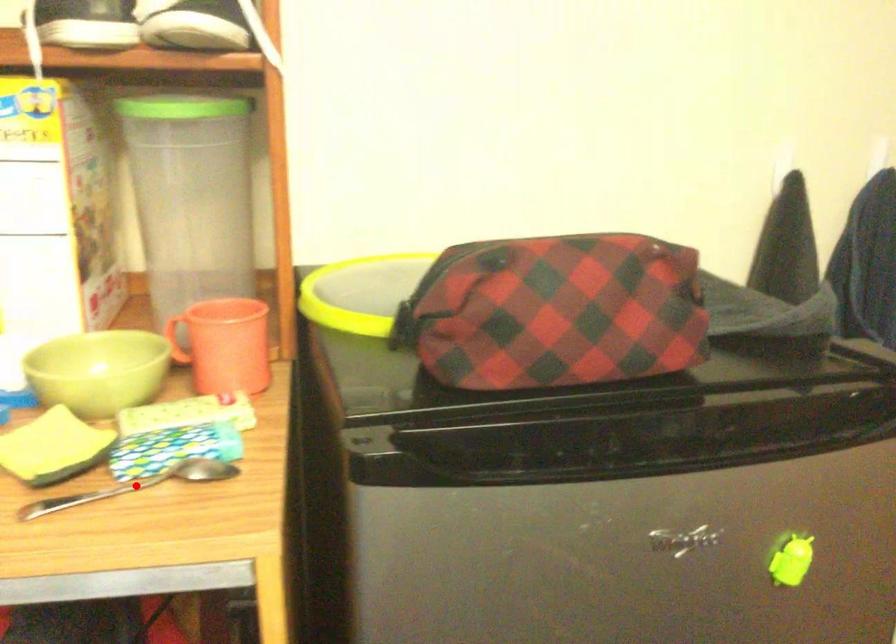
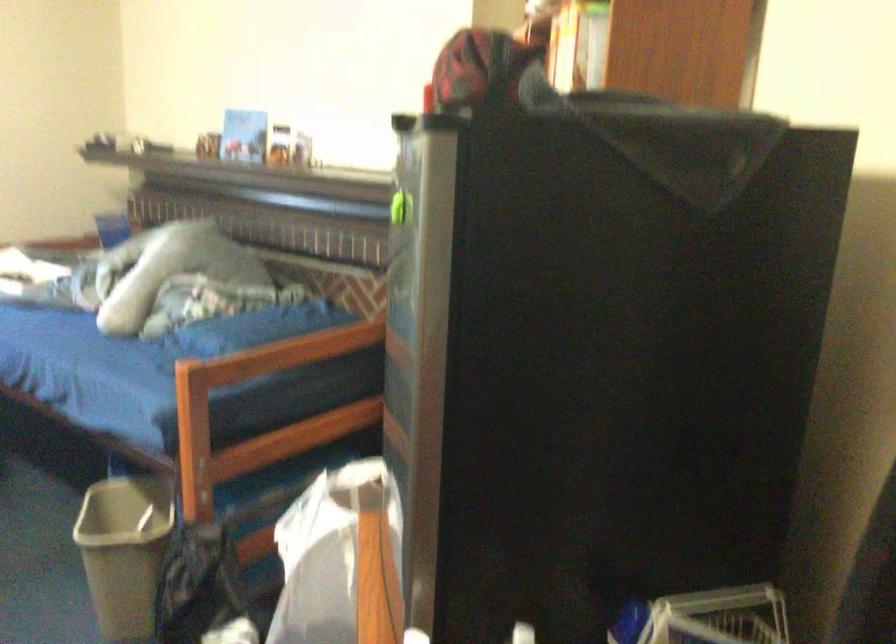
Question: I am providing you with two images of the same scene from different viewpoints. A red point is marked on the first image. Is the red point's position out of view in image 2?

Choices:
 (A) Yes
 (B) No

Answer: (A)